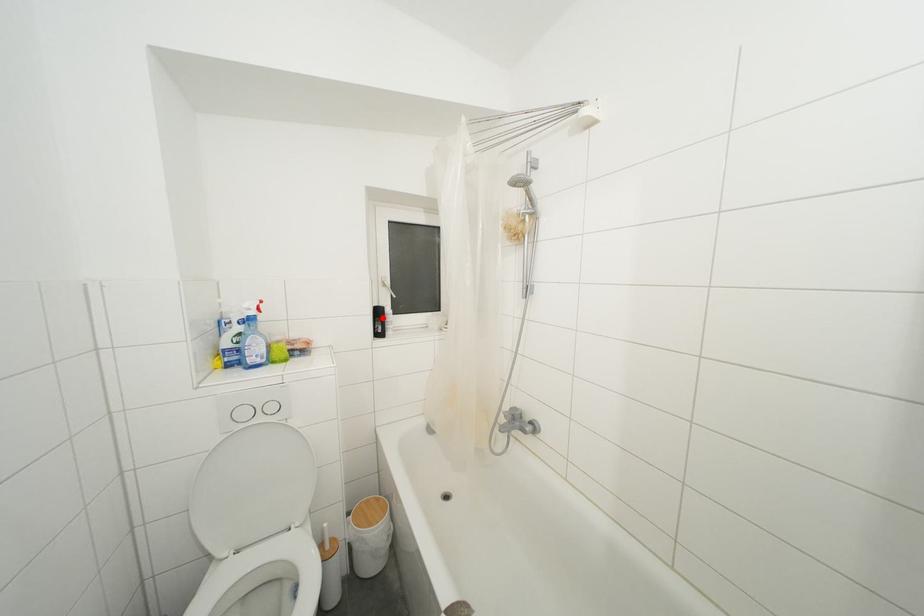
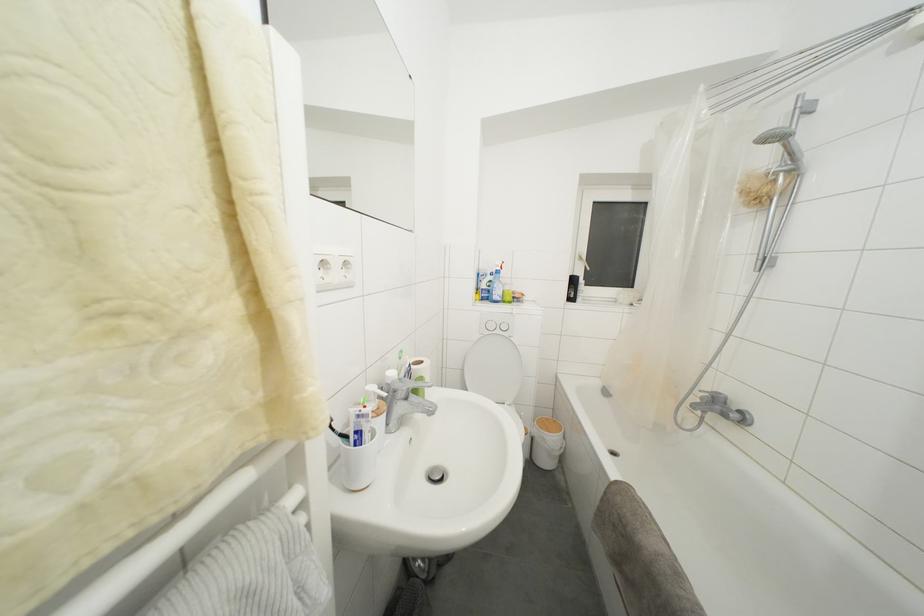
In the second image, find the point that corresponds to the highlighted location in the first image.

(578, 286)